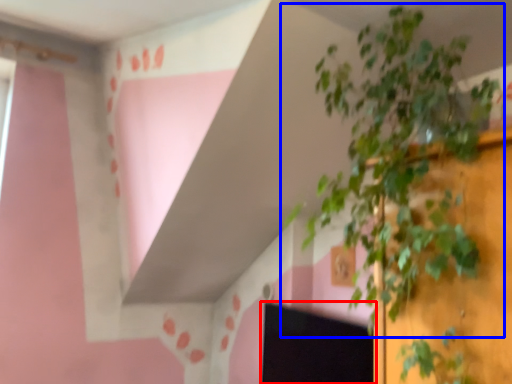
Question: Which object is closer to the camera taking this photo, computer screen (highlighted by a red box) or houseplant (highlighted by a blue box)?

Choices:
 (A) computer screen
 (B) houseplant

Answer: (B)